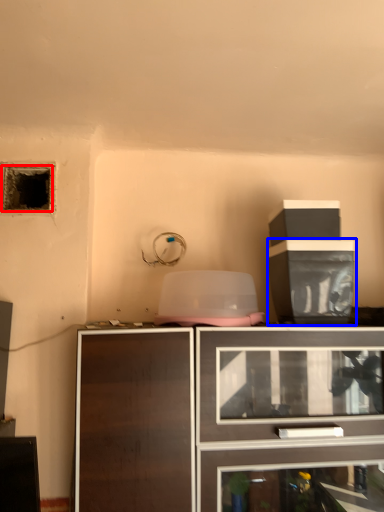
Question: Which of the following is the closest to the observer, hole (highlighted by a red box) or cabinetry (highlighted by a blue box)?

Choices:
 (A) hole
 (B) cabinetry

Answer: (B)